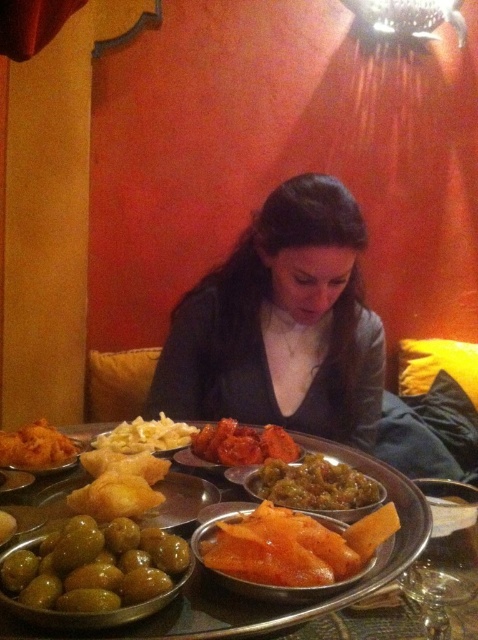
Question: Is matte black shirt at center smaller than golden fried pastry at center?

Choices:
 (A) no
 (B) yes

Answer: (A)

Question: Does green glossy olives at lower left appear under orange matte flatbread at center?

Choices:
 (A) yes
 (B) no

Answer: (B)

Question: Does matte black shirt at center have a smaller size compared to orange matte flatbread at center?

Choices:
 (A) yes
 (B) no

Answer: (B)

Question: Based on their relative distances, which object is farther from the matte yellow bread at lower left?

Choices:
 (A) matte black shirt at center
 (B) white creamy pasta at center

Answer: (A)

Question: Which point appears closest to the camera in this image?

Choices:
 (A) (175, 448)
 (B) (361, 474)
 (C) (102, 499)
 (D) (10, 451)

Answer: (C)

Question: Which point is closer to the camera taking this photo?

Choices:
 (A) click(262, 564)
 (B) click(110, 541)
 (C) click(0, 538)
 (D) click(6, 440)

Answer: (A)